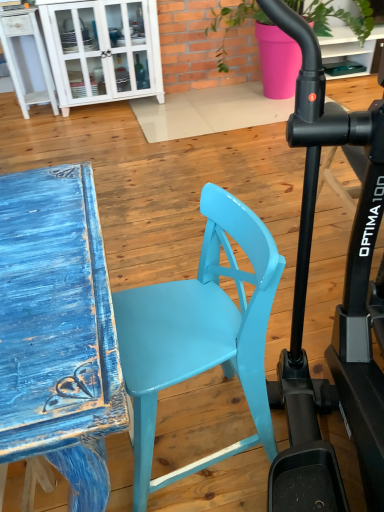
Question: Is matte pink pot at upper center next to white glossy cabinet at upper left and touching it?

Choices:
 (A) yes
 (B) no

Answer: (B)

Question: Does matte pink pot at upper center have a greater width compared to white glossy cabinet at upper left?

Choices:
 (A) no
 (B) yes

Answer: (B)

Question: Is matte pink pot at upper center to the right of white glossy cabinet at upper left from the viewer's perspective?

Choices:
 (A) yes
 (B) no

Answer: (A)

Question: Is matte pink pot at upper center positioned with its back to white glossy cabinet at upper left?

Choices:
 (A) yes
 (B) no

Answer: (B)

Question: Is matte pink pot at upper center positioned in front of white glossy cabinet at upper left?

Choices:
 (A) no
 (B) yes

Answer: (B)

Question: Is matte pink pot at upper center thinner than white glossy cabinet at upper left?

Choices:
 (A) yes
 (B) no

Answer: (B)

Question: Is glossy plastic chair at center not near matte pink pot at upper center?

Choices:
 (A) no
 (B) yes

Answer: (B)

Question: Is glossy plastic chair at center at the left side of matte pink pot at upper center?

Choices:
 (A) yes
 (B) no

Answer: (A)

Question: Could you tell me if glossy plastic chair at center is turned towards matte pink pot at upper center?

Choices:
 (A) no
 (B) yes

Answer: (A)

Question: Considering the relative sizes of glossy plastic chair at center and matte pink pot at upper center in the image provided, is glossy plastic chair at center smaller than matte pink pot at upper center?

Choices:
 (A) yes
 (B) no

Answer: (A)

Question: Considering the relative sizes of glossy plastic chair at center and matte pink pot at upper center in the image provided, is glossy plastic chair at center taller than matte pink pot at upper center?

Choices:
 (A) yes
 (B) no

Answer: (B)

Question: Is glossy plastic chair at center to the right of matte pink pot at upper center from the viewer's perspective?

Choices:
 (A) yes
 (B) no

Answer: (B)

Question: Does white glossy cabinet at upper left appear on the left side of matte pink pot at upper center?

Choices:
 (A) no
 (B) yes

Answer: (B)